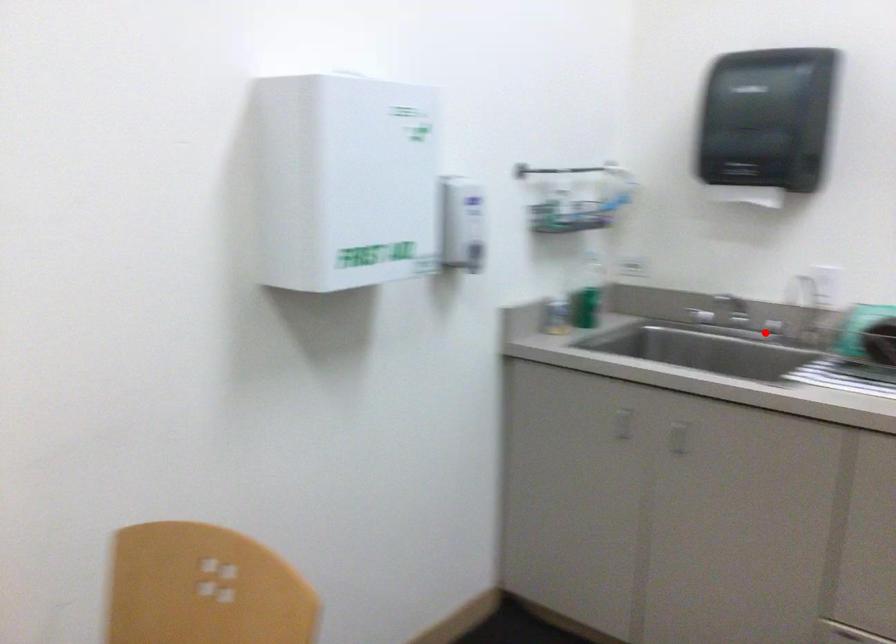
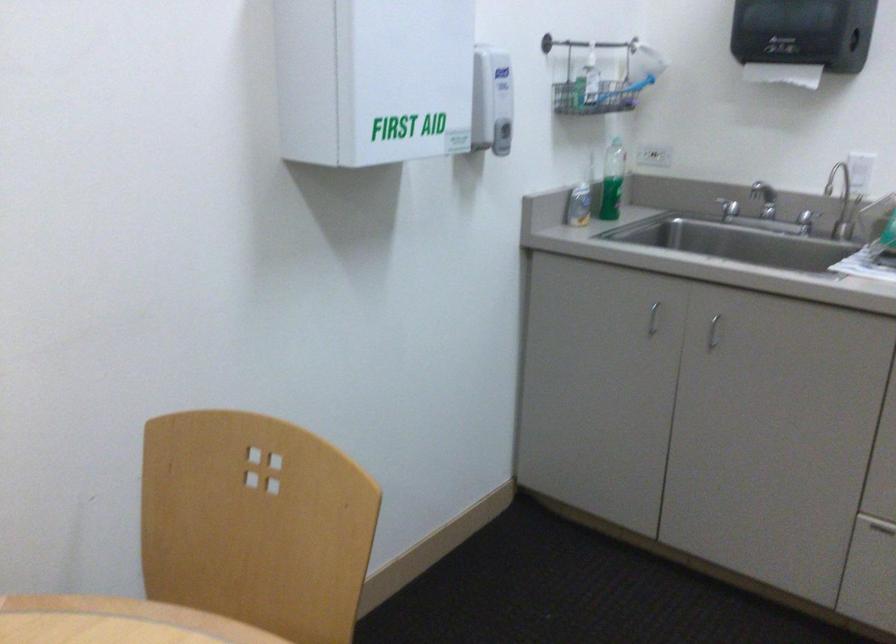
Locate, in the second image, the point that corresponds to the highlighted location in the first image.

(806, 221)